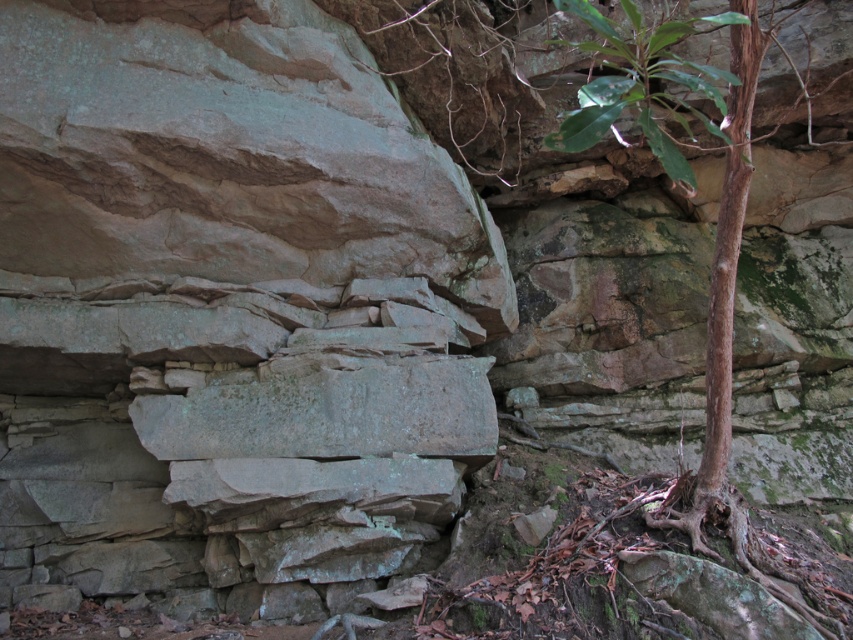
You are a hiker trying to navigate through the rocky terrain. You see the gray stone wall at center and the green leafy plant at upper right. Which object is taller?

The gray stone wall at center is taller than the green leafy plant at upper right.

You are a hiker trying to navigate through the rocky terrain. You see the gray stone wall at center and the green leafy plant at upper right. Which object is positioned higher up in the scene?

The green leafy plant at upper right is positioned higher up in the scene than the gray stone wall at center.